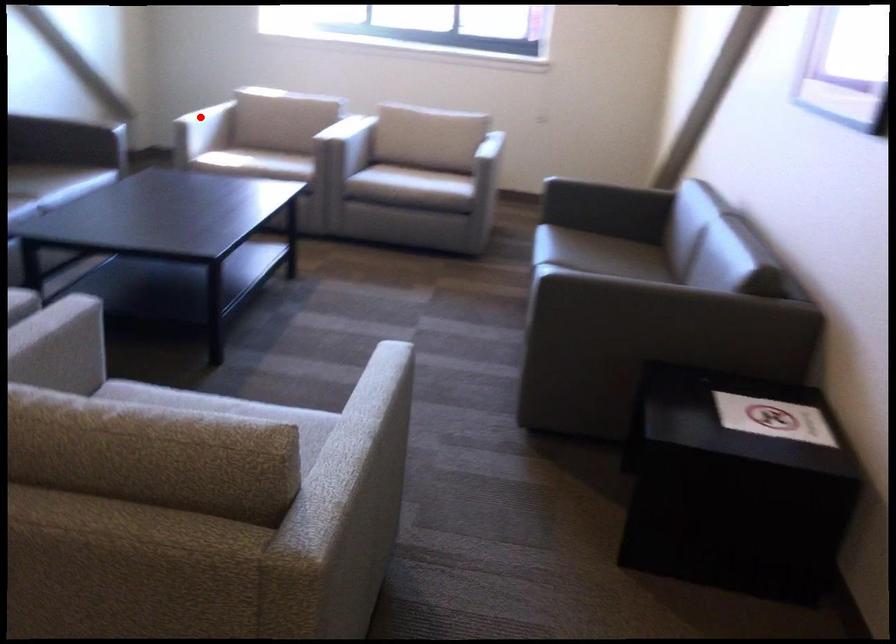
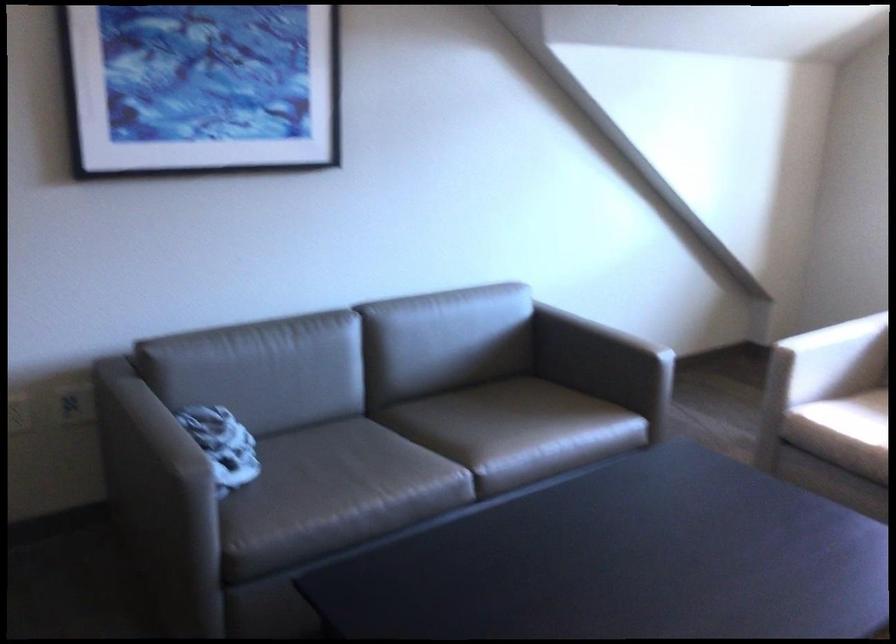
Question: A red point is marked in image1. In image2, is the corresponding 3D point closer to the camera or farther? Reply with the corresponding letter.

Choices:
 (A) The corresponding 3D point is closer.
 (B) The corresponding 3D point is farther.

Answer: (A)